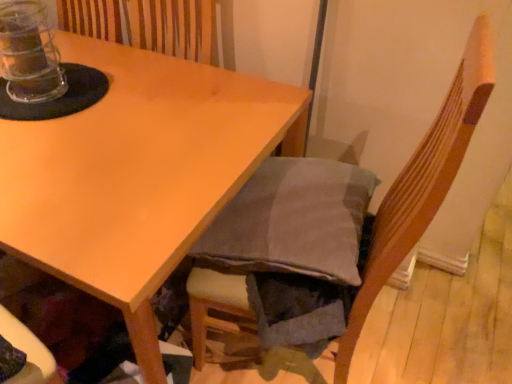
Question: Is matte wood table at upper left smaller than dark gray fabric chair at lower right?

Choices:
 (A) no
 (B) yes

Answer: (A)

Question: From the image's perspective, would you say matte wood table at upper left is shown under dark gray fabric chair at lower right?

Choices:
 (A) no
 (B) yes

Answer: (A)

Question: Considering the relative sizes of matte wood table at upper left and dark gray fabric chair at lower right in the image provided, is matte wood table at upper left taller than dark gray fabric chair at lower right?

Choices:
 (A) yes
 (B) no

Answer: (B)

Question: Is matte wood table at upper left not near dark gray fabric chair at lower right?

Choices:
 (A) yes
 (B) no

Answer: (B)

Question: From a real-world perspective, is matte wood table at upper left under dark gray fabric chair at lower right?

Choices:
 (A) yes
 (B) no

Answer: (A)

Question: Does matte wood table at upper left have a greater width compared to dark gray fabric chair at lower right?

Choices:
 (A) no
 (B) yes

Answer: (B)

Question: From the image's perspective, is matte wood table at upper left under transparent plastic jar at top left?

Choices:
 (A) no
 (B) yes

Answer: (B)

Question: From a real-world perspective, is matte wood table at upper left physically above transparent plastic jar at top left?

Choices:
 (A) yes
 (B) no

Answer: (B)

Question: Is transparent plastic jar at top left inside matte wood table at upper left?

Choices:
 (A) yes
 (B) no

Answer: (B)

Question: Is matte wood table at upper left smaller than transparent plastic jar at top left?

Choices:
 (A) yes
 (B) no

Answer: (B)

Question: Considering the relative sizes of matte wood table at upper left and transparent plastic jar at top left in the image provided, is matte wood table at upper left thinner than transparent plastic jar at top left?

Choices:
 (A) no
 (B) yes

Answer: (A)

Question: Can you confirm if matte wood table at upper left is bigger than transparent plastic jar at top left?

Choices:
 (A) no
 (B) yes

Answer: (B)

Question: Does transparent plastic jar at top left have a lesser height compared to dark gray fabric chair at lower right?

Choices:
 (A) no
 (B) yes

Answer: (B)